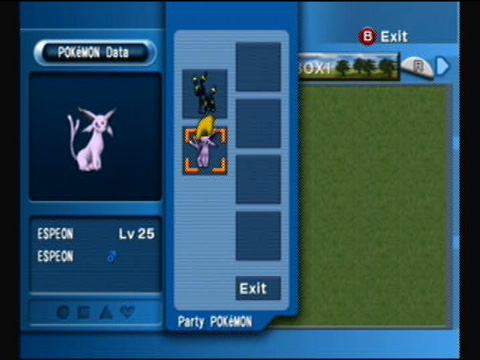
Identify the location of exit button. This screenshot has width=480, height=360. (390, 41).